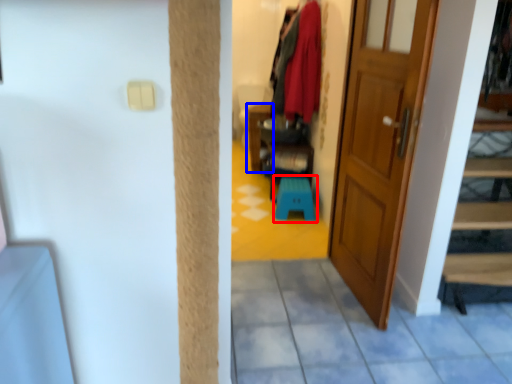
Question: Which object is further to the camera taking this photo, step stool (highlighted by a red box) or furniture (highlighted by a blue box)?

Choices:
 (A) step stool
 (B) furniture

Answer: (B)